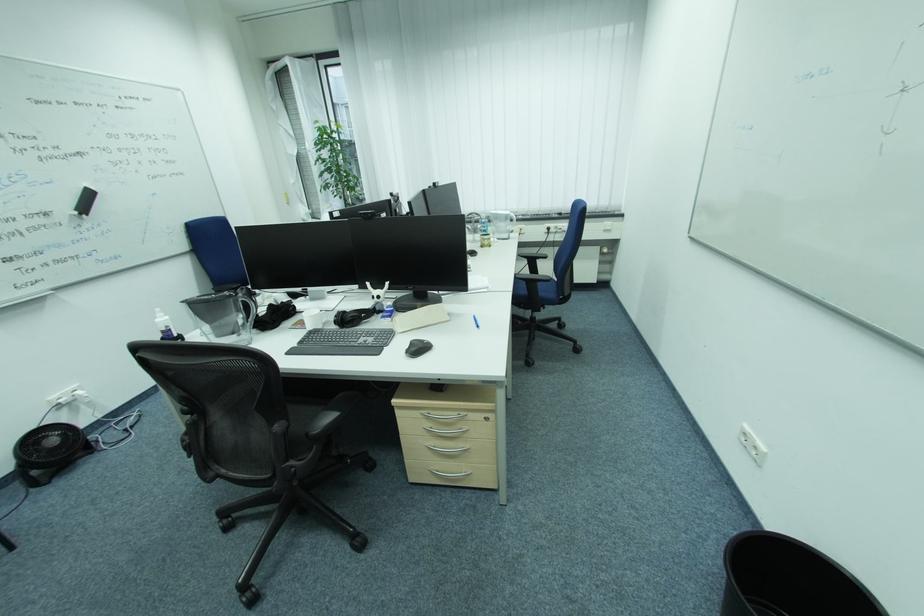
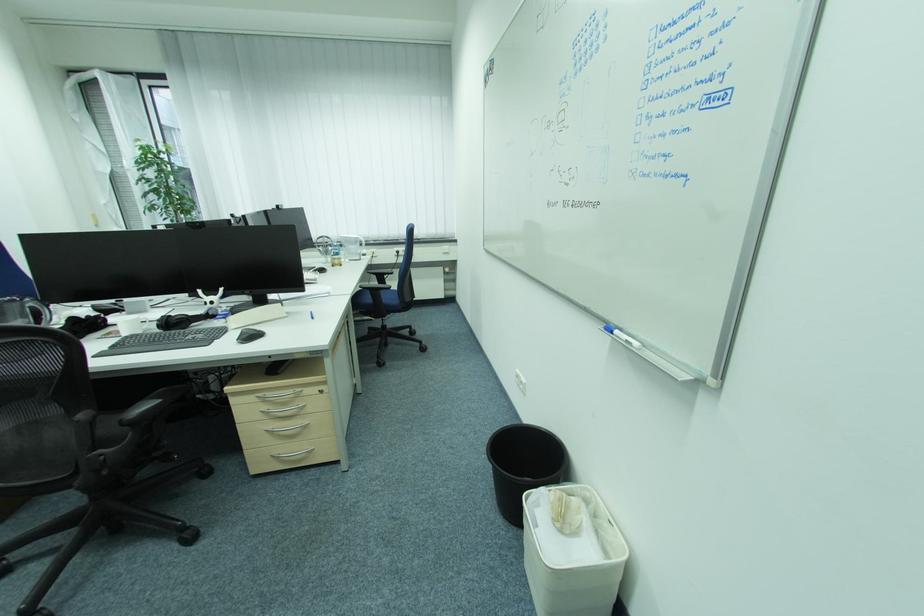
Where in the second image is the point corresponding to pixel 487 246 from the first image?

(337, 265)